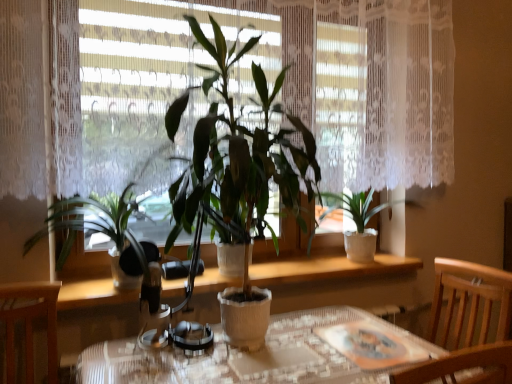
Question: Is green matte plant at center, which is the 2th houseplant in right-to-left order, touching green matte plant at center, the first houseplant when ordered from left to right?

Choices:
 (A) no
 (B) yes

Answer: (A)

Question: Is green matte plant at center, which is the 2th houseplant in right-to-left order, closer to the viewer compared to green matte plant at center, the first houseplant when ordered from left to right?

Choices:
 (A) yes
 (B) no

Answer: (A)

Question: Does green matte plant at center, which is the 2th houseplant in right-to-left order, have a greater height compared to green matte plant at center, which appears as the third houseplant when viewed from the right?

Choices:
 (A) yes
 (B) no

Answer: (A)

Question: Is green matte plant at center, which is the 2th houseplant in right-to-left order, facing away from green matte plant at center, which appears as the third houseplant when viewed from the right?

Choices:
 (A) no
 (B) yes

Answer: (A)

Question: From a real-world perspective, is green matte plant at center, which is the 2th houseplant in left-to-right order, physically below green matte plant at center, the first houseplant when ordered from left to right?

Choices:
 (A) yes
 (B) no

Answer: (B)

Question: Looking at the image, does green matte plant at center, which is the 2th houseplant in left-to-right order, seem bigger or smaller compared to green matte plant at center, which appears as the third houseplant when viewed from the right?

Choices:
 (A) big
 (B) small

Answer: (A)

Question: From the image's perspective, is green matte plant at center, which is the 2th houseplant in right-to-left order, positioned above or below green matte plant at center, the first houseplant when ordered from left to right?

Choices:
 (A) above
 (B) below

Answer: (A)

Question: Is point (232, 339) closer or farther from the camera than point (94, 218)?

Choices:
 (A) farther
 (B) closer

Answer: (B)

Question: Which is correct: green matte plant at center, which is the 2th houseplant in right-to-left order, is inside green matte plant at center, the first houseplant when ordered from left to right, or outside of it?

Choices:
 (A) outside
 (B) inside

Answer: (A)

Question: Based on their positions, is green matte plant at center, which appears as the third houseplant when viewed from the right, located to the left or right of green leafy plant at center?

Choices:
 (A) left
 (B) right

Answer: (A)

Question: Do you think green matte plant at center, the first houseplant when ordered from left to right, is within green leafy plant at center, or outside of it?

Choices:
 (A) outside
 (B) inside

Answer: (A)

Question: From a real-world perspective, is green matte plant at center, the first houseplant when ordered from left to right, above or below green leafy plant at center?

Choices:
 (A) above
 (B) below

Answer: (B)

Question: Looking at the image, does green matte plant at center, which appears as the third houseplant when viewed from the right, seem bigger or smaller compared to green leafy plant at center?

Choices:
 (A) small
 (B) big

Answer: (A)

Question: In the image, is green matte plant at center, which is the 2th houseplant in left-to-right order, positioned in front of or behind textured glass table at center?

Choices:
 (A) front
 (B) behind

Answer: (B)

Question: In terms of width, does green matte plant at center, which is the 2th houseplant in right-to-left order, look wider or thinner when compared to textured glass table at center?

Choices:
 (A) wide
 (B) thin

Answer: (B)